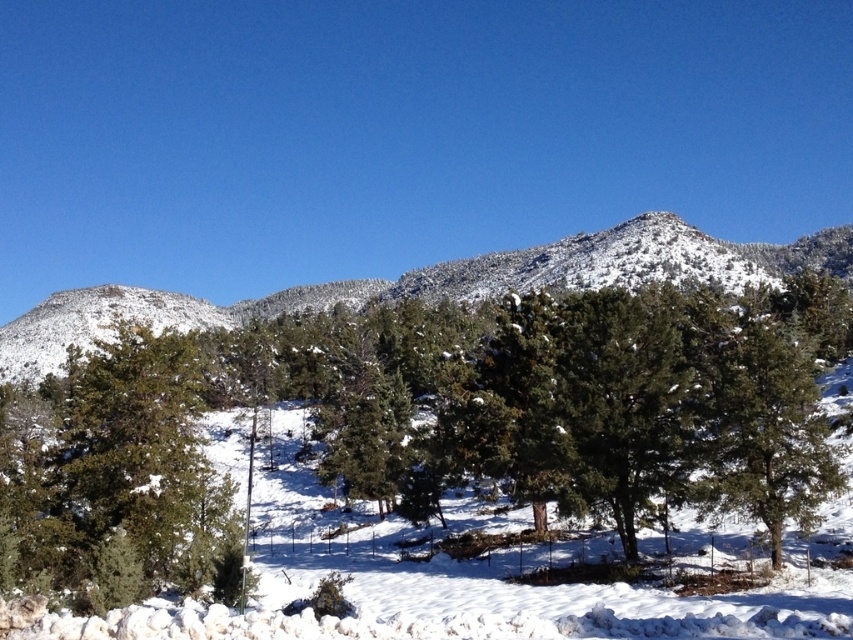
Question: Observing the image, what is the correct spatial positioning of green matte tree at left in reference to snowy pine trees at center?

Choices:
 (A) left
 (B) right

Answer: (A)

Question: From the image, what is the correct spatial relationship of green matte tree at left in relation to snowy pine trees at center?

Choices:
 (A) left
 (B) right

Answer: (A)

Question: In this image, where is green matte tree at left located relative to snowy pine trees at center?

Choices:
 (A) above
 (B) below

Answer: (B)

Question: Which point appears closest to the camera in this image?

Choices:
 (A) (90, 304)
 (B) (100, 428)

Answer: (B)

Question: Which of the following is the closest to the observer?

Choices:
 (A) click(515, 282)
 (B) click(213, 468)

Answer: (B)